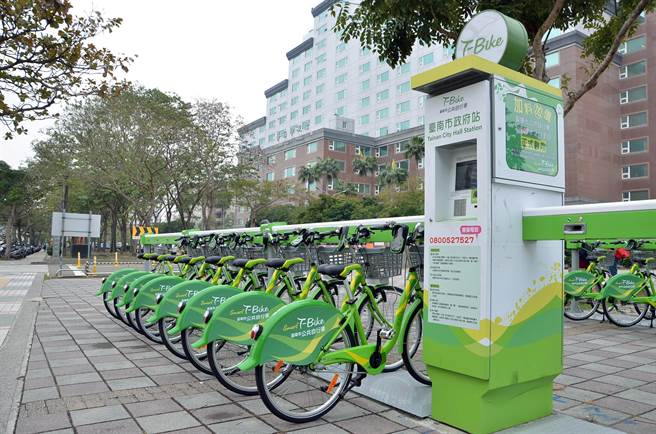
Locate the how many windows are visible along the edge of the right side of this picture? in the image. Your answer should be formatted as a list of tuples, i.e. [(x1, y1), (x2, y2), ...], where each tuple contains the x and y coordinates of a point satisfying the conditions above.

[(634, 44), (634, 66), (638, 92), (637, 118), (640, 142), (638, 166), (638, 193)]